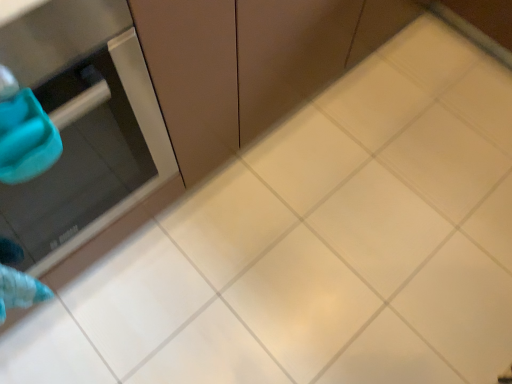
This screenshot has width=512, height=384. Describe the element at coordinates (249, 63) in the screenshot. I see `matte brown cabinet at center` at that location.

Measure the distance between point (x=154, y=41) and camera.

27.01 inches.

Identify the location of matte brown cabinet at center. pos(249,63).

Identify the location of stainless steel oven at left. This screenshot has width=512, height=384. (83, 126).

The height and width of the screenshot is (384, 512). Describe the element at coordinates (83, 126) in the screenshot. I see `stainless steel oven at left` at that location.

The image size is (512, 384). Find the location of `matte brown cabinet at center`. matte brown cabinet at center is located at coordinates (249, 63).

Visually, is stainless steel oven at left positioned to the left or to the right of matte brown cabinet at center?

Based on their positions, stainless steel oven at left is located to the left of matte brown cabinet at center.

Is stainless steel oven at left in front of or behind matte brown cabinet at center in the image?

In the image, stainless steel oven at left appears in front of matte brown cabinet at center.

Does point (123, 83) appear closer or farther from the camera than point (185, 128)?

Point (123, 83) is closer to the camera than point (185, 128).

Based on the photo, from the image's perspective, is stainless steel oven at left positioned above or below matte brown cabinet at center?

stainless steel oven at left is below matte brown cabinet at center.

From a real-world perspective, is stainless steel oven at left under matte brown cabinet at center?

No.

Which of these two, stainless steel oven at left or matte brown cabinet at center, is thinner?

matte brown cabinet at center is thinner.

Considering the relative sizes of stainless steel oven at left and matte brown cabinet at center in the image provided, is stainless steel oven at left taller than matte brown cabinet at center?

Yes.

Who is bigger, stainless steel oven at left or matte brown cabinet at center?

matte brown cabinet at center.

Is stainless steel oven at left completely or partially outside of matte brown cabinet at center?

stainless steel oven at left lies outside matte brown cabinet at center's area.

Are stainless steel oven at left and matte brown cabinet at center far apart?

No, stainless steel oven at left is not far from matte brown cabinet at center.

Is stainless steel oven at left oriented away from matte brown cabinet at center?

No, matte brown cabinet at center is not at the back of stainless steel oven at left.

Can you tell me how much stainless steel oven at left and matte brown cabinet at center differ in facing direction?

The angle between the facing direction of stainless steel oven at left and the facing direction of matte brown cabinet at center is 4.6e-05 degrees.

How distant is stainless steel oven at left from matte brown cabinet at center?

A distance of 23.88 centimeters exists between stainless steel oven at left and matte brown cabinet at center.

Identify the location of appliance located on the left of matte brown cabinet at center. The width and height of the screenshot is (512, 384). (83, 126).

Would you say matte brown cabinet at center is to the left or to the right of stainless steel oven at left in the picture?

Clearly, matte brown cabinet at center is on the right of stainless steel oven at left in the image.

Considering their positions, is matte brown cabinet at center located in front of or behind stainless steel oven at left?

Clearly, matte brown cabinet at center is behind stainless steel oven at left.

Which is in front, point (162, 60) or point (10, 204)?

The point (162, 60) is closer.

From the image's perspective, is matte brown cabinet at center positioned above or below stainless steel oven at left?

matte brown cabinet at center is above stainless steel oven at left.

From a real-world perspective, is matte brown cabinet at center above or below stainless steel oven at left?

Clearly, from a real-world perspective, matte brown cabinet at center is below stainless steel oven at left.

Which object is thinner, matte brown cabinet at center or stainless steel oven at left?

With smaller width is matte brown cabinet at center.

Which of these two, matte brown cabinet at center or stainless steel oven at left, stands taller?

With more height is stainless steel oven at left.

Which of these two, matte brown cabinet at center or stainless steel oven at left, is bigger?

matte brown cabinet at center.

Do you think matte brown cabinet at center is within stainless steel oven at left, or outside of it?

matte brown cabinet at center is spatially situated outside stainless steel oven at left.

Is matte brown cabinet at center far from stainless steel oven at left?

No.

Is matte brown cabinet at center oriented towards stainless steel oven at left?

No, matte brown cabinet at center is not facing towards stainless steel oven at left.

At what (x,y) coordinates should I click in order to perform the action: click on appliance on the left of the matte brown cabinet at center. Please return your answer as a coordinate pair (x, y). This screenshot has width=512, height=384. Looking at the image, I should click on (83, 126).

Locate an element on the screen. appliance below the matte brown cabinet at center (from the image's perspective) is located at coordinates (83, 126).

Locate an element on the screen. cabinetry behind the stainless steel oven at left is located at coordinates (249, 63).